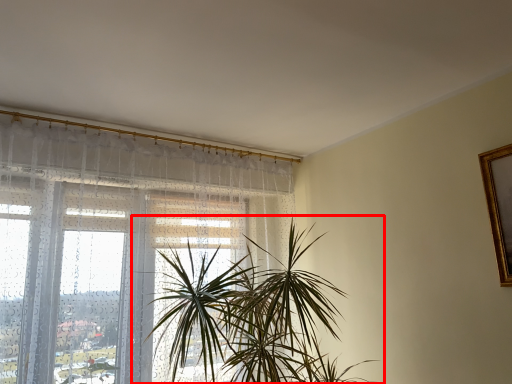
Question: Considering the relative positions of houseplant (annotated by the red box) and window in the image provided, where is houseplant (annotated by the red box) located with respect to the staircase?

Choices:
 (A) left
 (B) right

Answer: (B)